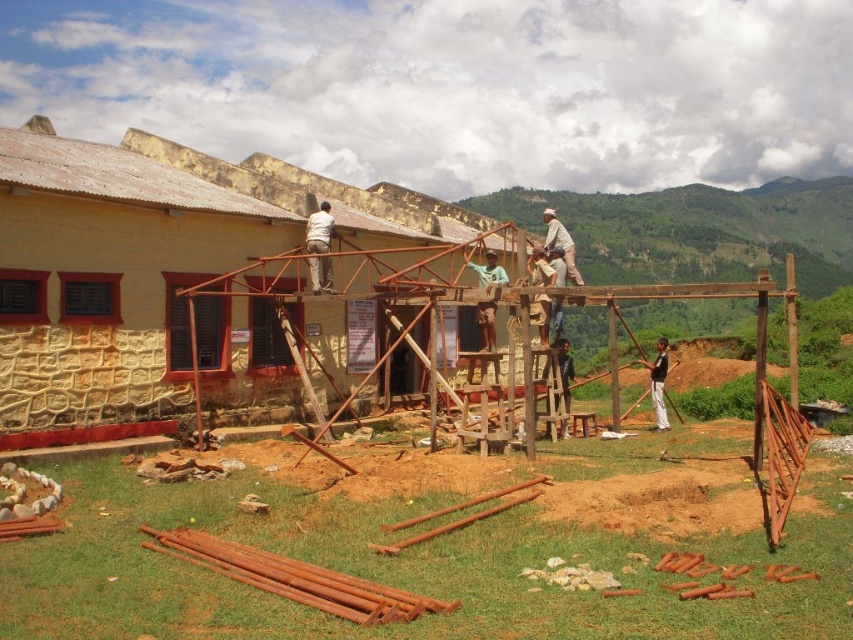
Is blue fabric shirt at center closer to camera compared to light brown wooden pole at upper center?

That is True.

Between blue fabric shirt at center and light brown wooden pole at upper center, which one has more height?

light brown wooden pole at upper center is taller.

Which is behind, point (489, 284) or point (564, 259)?

The point (564, 259) is more distant.

Identify the location of blue fabric shirt at center. (488, 272).

Is point (316, 241) closer to camera compared to point (531, 269)?

That is True.

What do you see at coordinates (318, 248) in the screenshot? I see `light brown fabric shirt at upper center` at bounding box center [318, 248].

At what (x,y) coordinates should I click in order to perform the action: click on light brown fabric shirt at upper center. Please return your answer as a coordinate pair (x, y). Looking at the image, I should click on (318, 248).

Is light brown fabric shirt at upper center taller than dark blue jeans at center?

Correct, light brown fabric shirt at upper center is much taller as dark blue jeans at center.

Between point (306, 225) and point (544, 369), which one is positioned in front?

Point (544, 369)

Where is `light brown fabric shirt at upper center`? This screenshot has width=853, height=640. light brown fabric shirt at upper center is located at coordinates (318, 248).